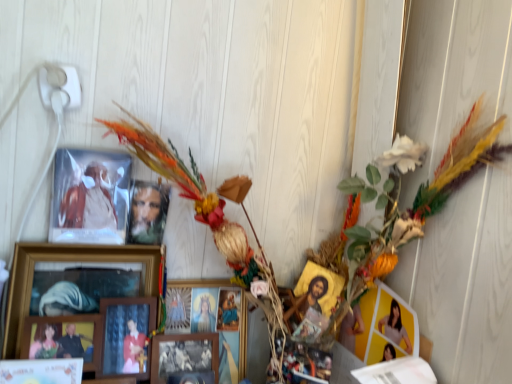
Question: Considering the positions of point (327, 312) and point (1, 375), is point (327, 312) closer or farther from the camera than point (1, 375)?

Choices:
 (A) farther
 (B) closer

Answer: (A)

Question: Looking at the image, does gold textured icon at center-right, which is the 8th picture frame in left-to-right order, seem bigger or smaller compared to white glossy picture frame at lower left, the eighth picture frame in the right-to-left sequence?

Choices:
 (A) big
 (B) small

Answer: (B)

Question: Considering the real-world distances, which object is farthest from the multicolored feathered wreath at upper left?

Choices:
 (A) wooden framed picture at center, the 7th picture frame when ordered from left to right
 (B) gold textured icon at center-right, which is the 8th picture frame in left-to-right order
 (C) matte wooden portrait at upper left, arranged as the fifth picture frame when viewed from the left
 (D) white glossy picture frame at lower left, the eighth picture frame in the right-to-left sequence
 (E) wooden framed picture at center, the fifth picture frame viewed from the right

Answer: (D)

Question: Estimate the real-world distances between objects in this image. Which object is farther from the matte wooden portrait at upper left, marked as the 4th picture frame in a right-to-left arrangement?

Choices:
 (A) wooden picture frame at lower left, the 7th picture frame when ordered from right to left
 (B) wooden photo frame at center, acting as the 3th picture frame starting from the right
 (C) multicolored feathered wreath at upper left
 (D) wooden framed picture at center, the 7th picture frame when ordered from left to right
 (E) gold textured icon at center-right, which is the 8th picture frame in left-to-right order

Answer: (C)